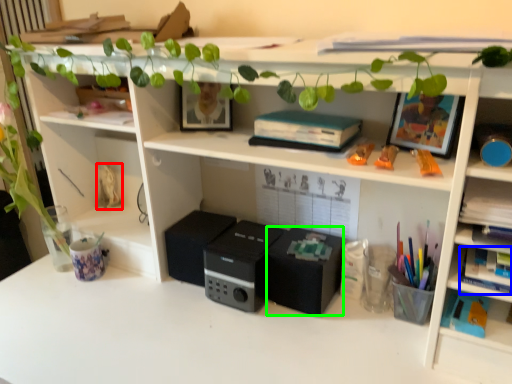
Question: Which is nearer to the toy (highlighted by a red box)? book (highlighted by a blue box) or speaker (highlighted by a green box).

Choices:
 (A) book
 (B) speaker

Answer: (B)